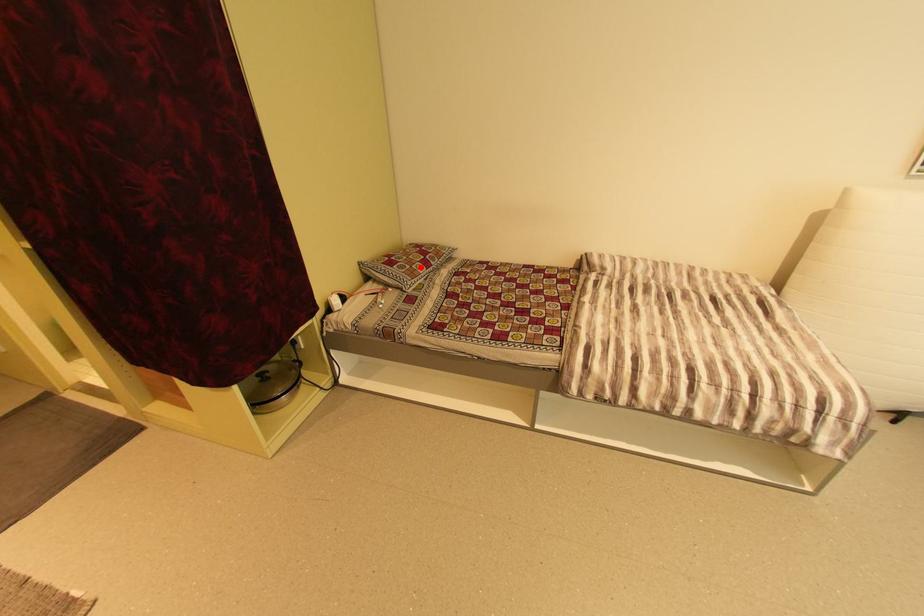
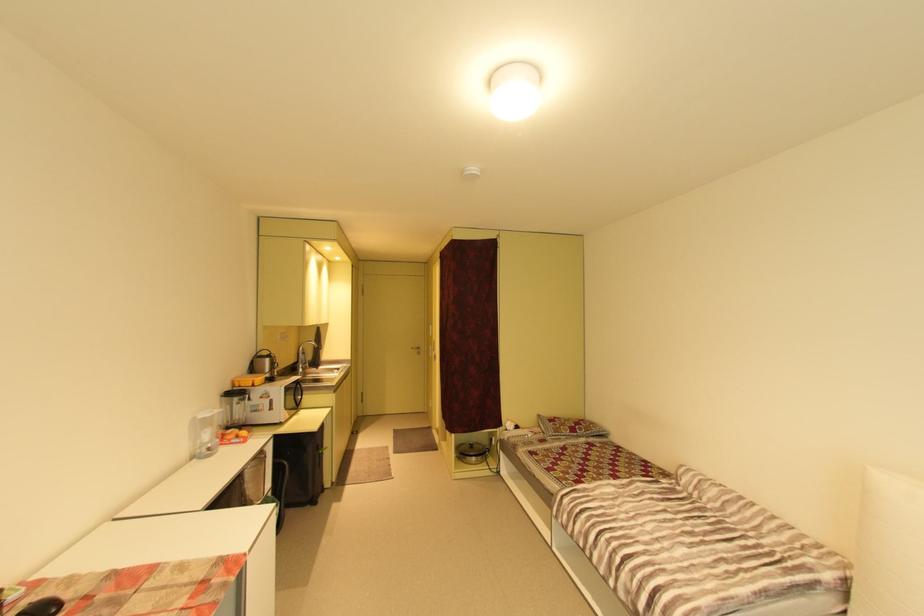
Question: I am providing you with two images of the same scene from different viewpoints. Image1 has a red point marked. In image2, the corresponding 3D location appears at what relative position? Reply with the corresponding letter.

Choices:
 (A) Closer
 (B) Farther

Answer: (B)